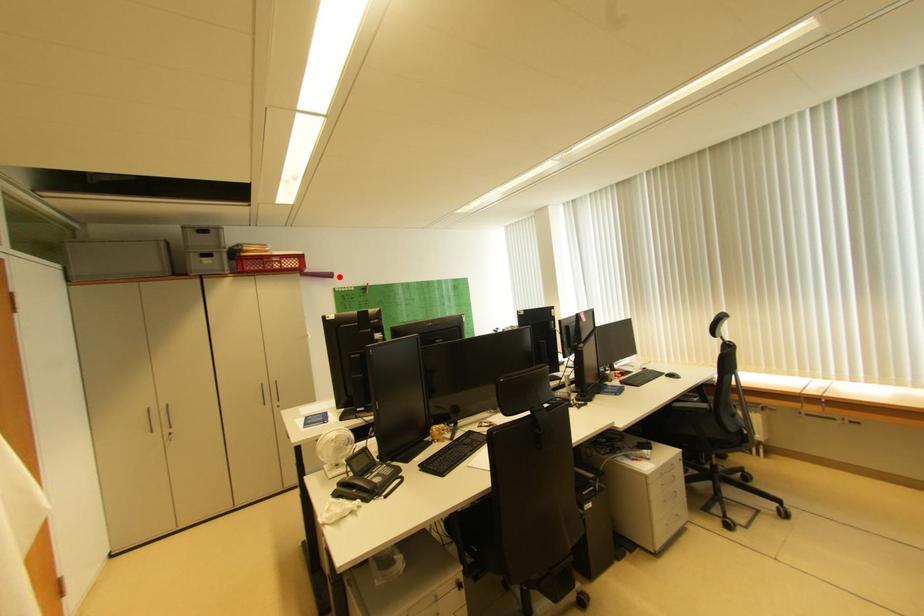
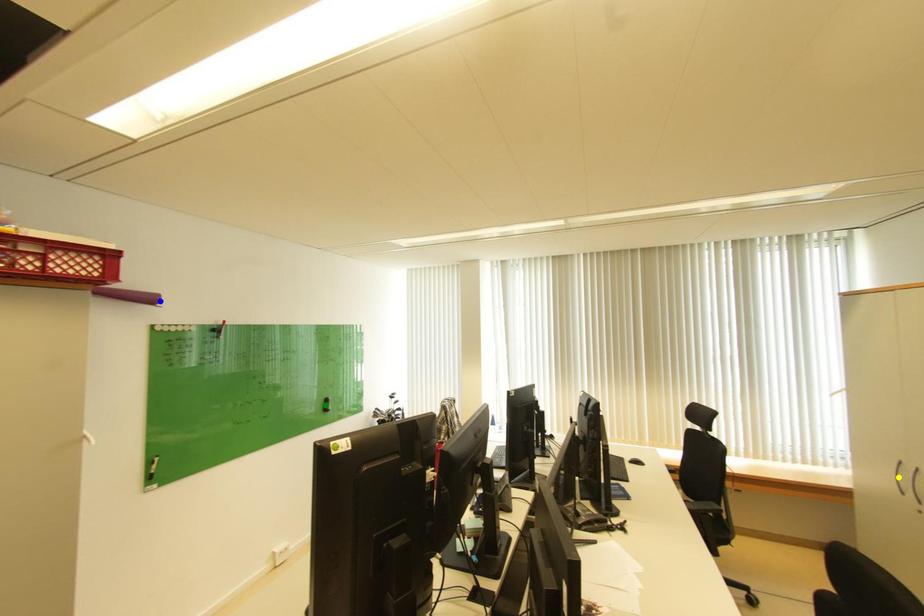
Question: I am providing you with two images of the same scene from different viewpoints. A red point is marked on the first image. You are given multiple points on the second image. Which point in image 2 is actually the same real-world point as the red point in image 1?

Choices:
 (A) green point
 (B) blue point
 (C) yellow point

Answer: (B)